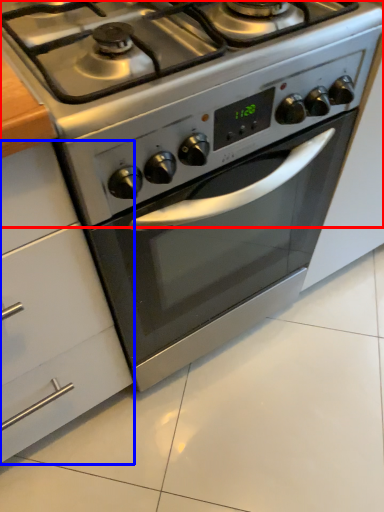
Question: Which object is closer to the camera taking this photo, gas stove (highlighted by a red box) or cabinetry (highlighted by a blue box)?

Choices:
 (A) gas stove
 (B) cabinetry

Answer: (B)